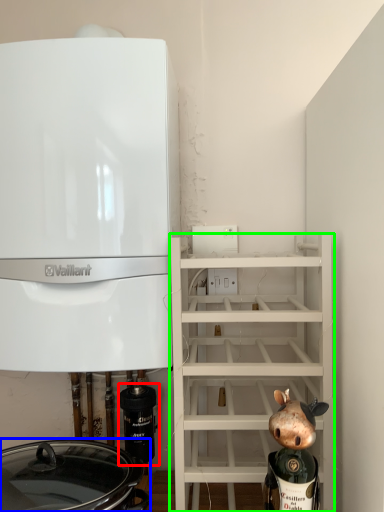
Question: Estimate the real-world distances between objects in this image. Which object is closer to appliance (highlighted by a red box), crock pot (highlighted by a blue box) or shelf (highlighted by a green box)?

Choices:
 (A) crock pot
 (B) shelf

Answer: (A)